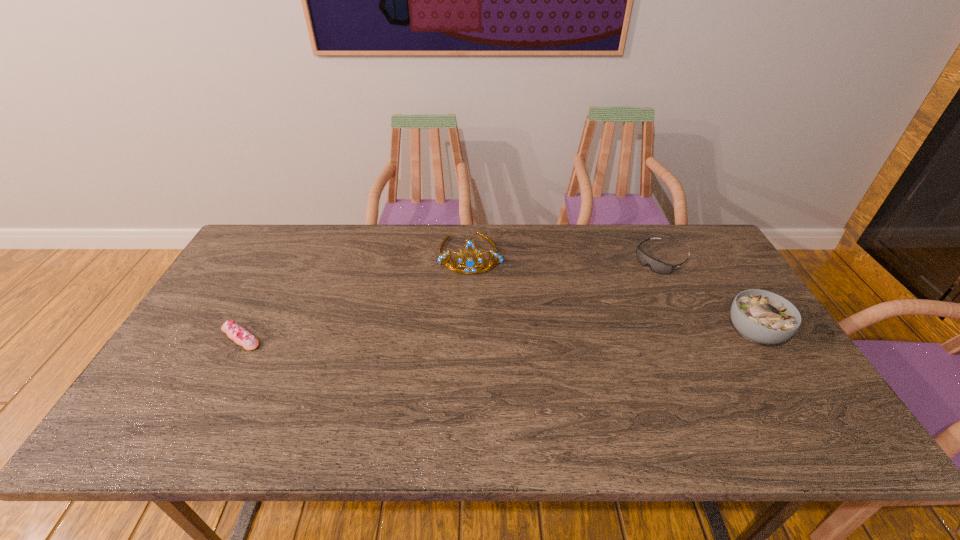
At what (x,y) coordinates should I click in order to perform the action: click on vacant space at the far edge of the desktop. Please return your answer as a coordinate pair (x, y). This screenshot has height=540, width=960. Looking at the image, I should click on (369, 227).

Locate an element on the screen. The image size is (960, 540). vacant space at the near edge is located at coordinates (544, 405).

This screenshot has width=960, height=540. In the image, there is a desktop. In order to click on vacant region at the left edge in this screenshot , I will do `click(250, 272)`.

Where is `free location at the far left corner of the desktop`? free location at the far left corner of the desktop is located at coordinates (269, 248).

What are the coordinates of `vacant space at the near left corner` in the screenshot? It's located at (190, 396).

Locate an element on the screen. free space at the far right corner of the desktop is located at coordinates (698, 253).

I want to click on empty space that is in between the third shortest object and the shortest object, so click(x=497, y=335).

Locate an element on the screen. empty space between the soup bowl and the leftmost object is located at coordinates (497, 335).

This screenshot has height=540, width=960. I want to click on vacant region between the soup bowl and the goggles, so click(708, 296).

Locate an element on the screen. This screenshot has width=960, height=540. free space between the eclair and the tallest object is located at coordinates (356, 295).